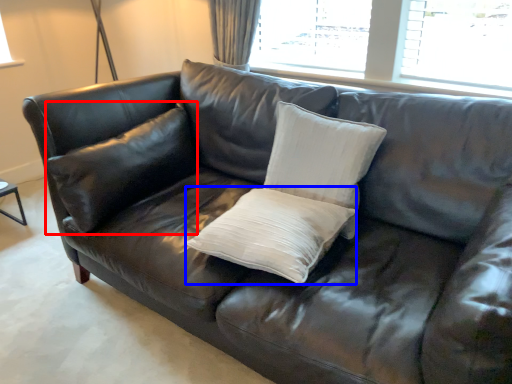
Question: Which object appears farthest to the camera in this image, pillow (highlighted by a red box) or pillow (highlighted by a blue box)?

Choices:
 (A) pillow
 (B) pillow

Answer: (A)